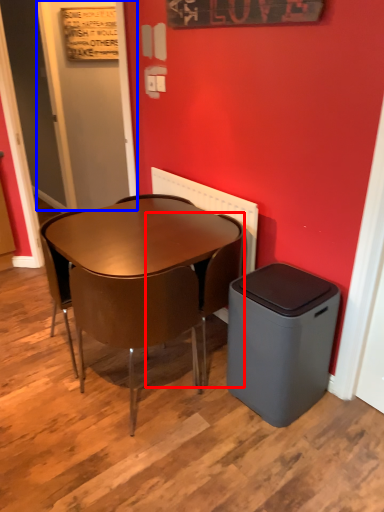
Question: Which point is further to the camera, chair (highlighted by a red box) or door (highlighted by a blue box)?

Choices:
 (A) chair
 (B) door

Answer: (B)